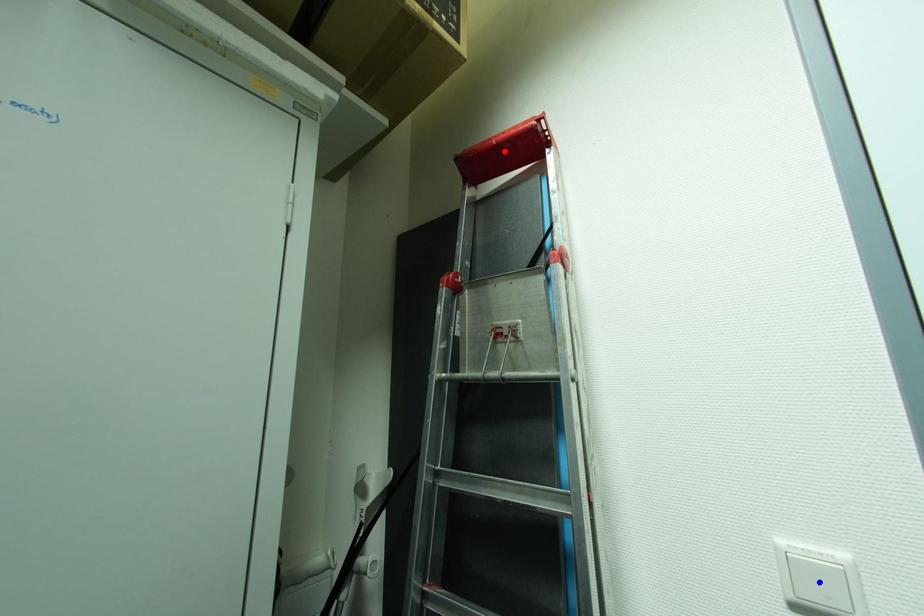
Question: Two points are marked on the image. Which point is closer to the camera?

Choices:
 (A) Blue point is closer.
 (B) Red point is closer.

Answer: (A)